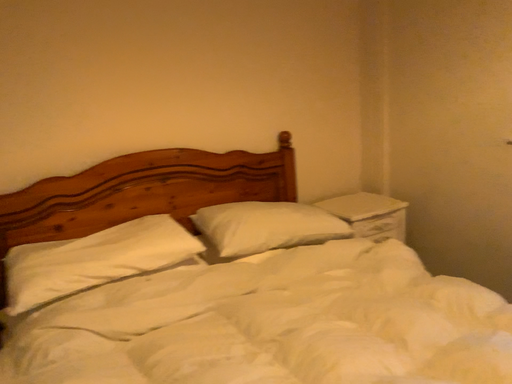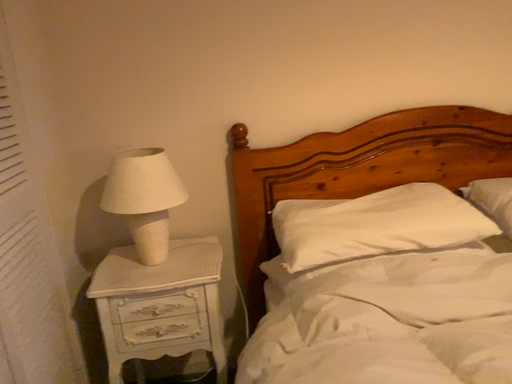
Question: Which way did the camera rotate in the video?

Choices:
 (A) rotated left
 (B) rotated right

Answer: (A)